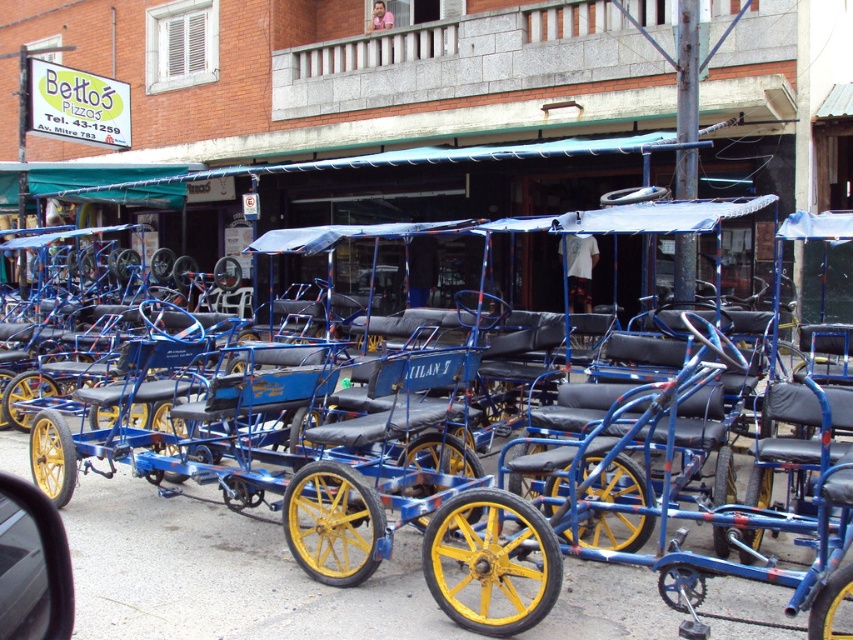
Find the location of a particular element. The image size is (853, 640). metallic blue tricycle at center is located at coordinates (428, 538).

In the scene shown: Between metallic blue tricycle at center and metallic blue car at lower left, which one is positioned higher?

metallic blue tricycle at center is above.

Which is behind, point (508, 541) or point (6, 628)?

The point (508, 541) is behind.

The width and height of the screenshot is (853, 640). What are the coordinates of `metallic blue tricycle at center` in the screenshot? It's located at (428, 538).